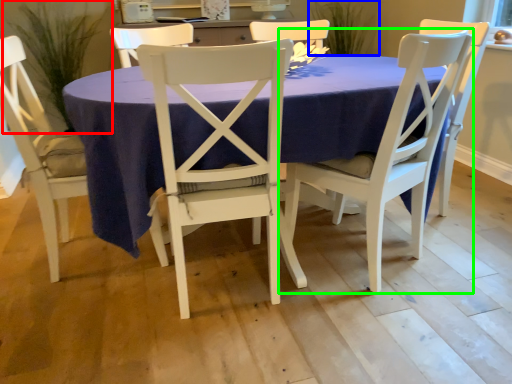
Question: Which object is the farthest from plant (highlighted by a red box)? Choose among these: plant (highlighted by a blue box) or chair (highlighted by a green box).

Choices:
 (A) plant
 (B) chair

Answer: (B)